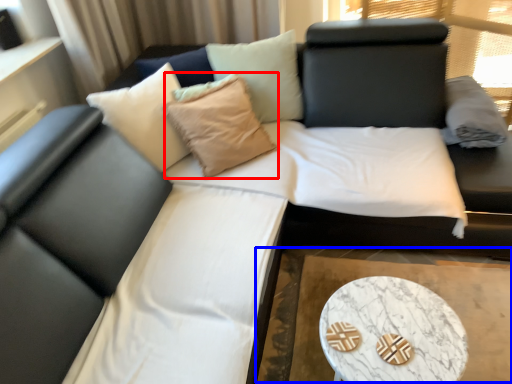
Question: Which object is closer to the camera taking this photo, throw pillow (highlighted by a red box) or cocktail table (highlighted by a blue box)?

Choices:
 (A) throw pillow
 (B) cocktail table

Answer: (B)